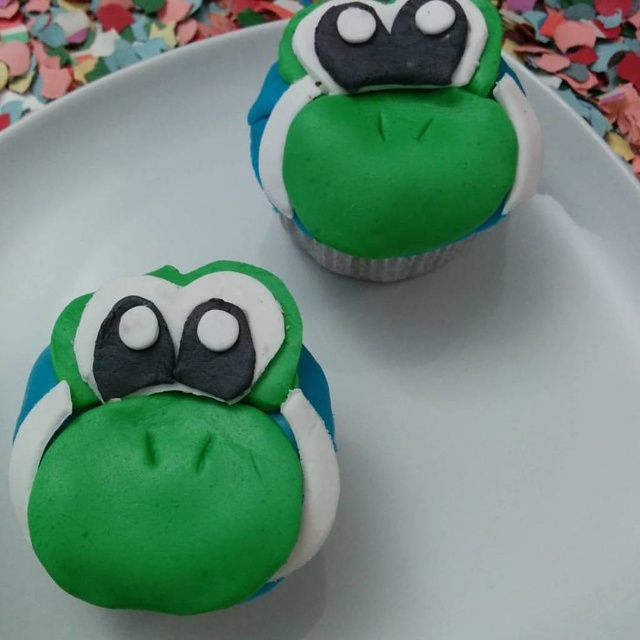
Is green matte cupcake at center taller than green matte cupcake at upper center?

Indeed, green matte cupcake at center has a greater height compared to green matte cupcake at upper center.

Between point (157, 480) and point (472, 141), which one is positioned in front?

Point (157, 480) is in front.

Locate an element on the screen. green matte cupcake at center is located at coordinates (176, 442).